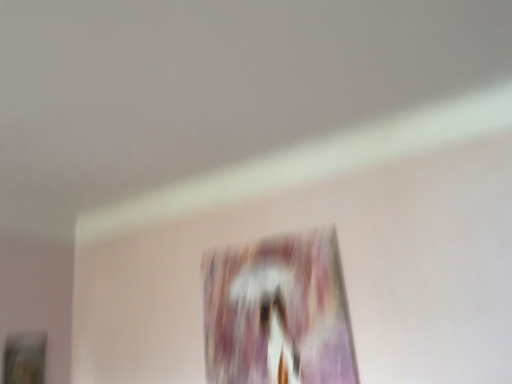
The width and height of the screenshot is (512, 384). Describe the element at coordinates (278, 313) in the screenshot. I see `metallic silver picture frame at center` at that location.

Where is `metallic silver picture frame at center`? The height and width of the screenshot is (384, 512). metallic silver picture frame at center is located at coordinates (278, 313).

At what (x,y) coordinates should I click in order to perform the action: click on metallic silver picture frame at center. Please return your answer as a coordinate pair (x, y). Image resolution: width=512 pixels, height=384 pixels. Looking at the image, I should click on (278, 313).